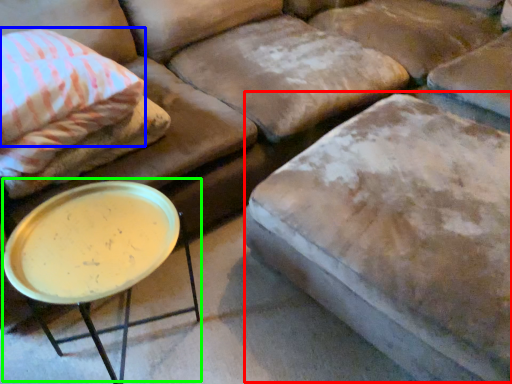
Question: Which object is the closest to the swivel chair (highlighted by a red box)? Choose among these: pillow (highlighted by a blue box) or round table (highlighted by a green box).

Choices:
 (A) pillow
 (B) round table

Answer: (B)